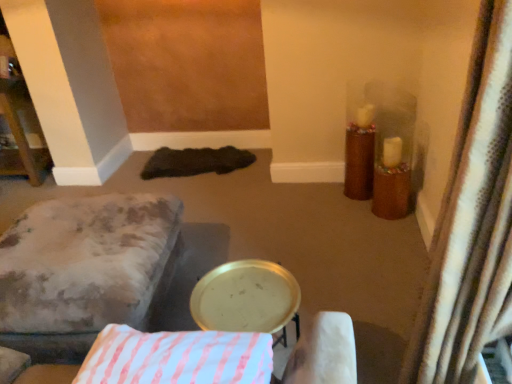
Question: Does velvet-like beige ottoman at lower left lie behind gold metallic tray at center?

Choices:
 (A) yes
 (B) no

Answer: (A)

Question: Does velvet-like beige ottoman at lower left appear on the left side of gold metallic tray at center?

Choices:
 (A) no
 (B) yes

Answer: (B)

Question: Is velvet-like beige ottoman at lower left smaller than gold metallic tray at center?

Choices:
 (A) no
 (B) yes

Answer: (A)

Question: From a real-world perspective, is velvet-like beige ottoman at lower left positioned under gold metallic tray at center based on gravity?

Choices:
 (A) no
 (B) yes

Answer: (B)

Question: Is velvet-like beige ottoman at lower left shorter than gold metallic tray at center?

Choices:
 (A) no
 (B) yes

Answer: (B)

Question: Do you think white textured curtain at right is within velvet-like beige ottoman at lower left, or outside of it?

Choices:
 (A) inside
 (B) outside

Answer: (B)

Question: Is point (462, 334) positioned closer to the camera than point (174, 258)?

Choices:
 (A) farther
 (B) closer

Answer: (B)

Question: In terms of width, does white textured curtain at right look wider or thinner when compared to velvet-like beige ottoman at lower left?

Choices:
 (A) wide
 (B) thin

Answer: (B)

Question: From the image's perspective, is white textured curtain at right positioned above or below velvet-like beige ottoman at lower left?

Choices:
 (A) above
 (B) below

Answer: (A)

Question: Based on their positions, is white striped fabric pillow at center located to the left or right of velvet-like beige ottoman at lower left?

Choices:
 (A) right
 (B) left

Answer: (A)

Question: In terms of width, does white striped fabric pillow at center look wider or thinner when compared to velvet-like beige ottoman at lower left?

Choices:
 (A) thin
 (B) wide

Answer: (A)

Question: From the image's perspective, is white striped fabric pillow at center positioned above or below velvet-like beige ottoman at lower left?

Choices:
 (A) below
 (B) above

Answer: (A)

Question: Is point (201, 331) closer or farther from the camera than point (26, 228)?

Choices:
 (A) closer
 (B) farther

Answer: (A)

Question: In terms of height, does white striped fabric pillow at center look taller or shorter compared to gold metallic tray at center?

Choices:
 (A) tall
 (B) short

Answer: (B)

Question: In the image, is white striped fabric pillow at center positioned in front of or behind gold metallic tray at center?

Choices:
 (A) behind
 (B) front

Answer: (B)